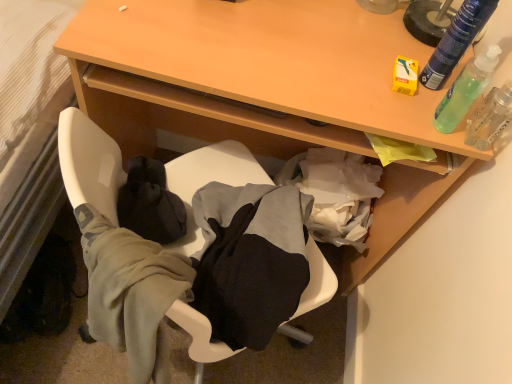
Find the location of a particular element. This screenshot has width=512, height=384. vacant region to the left of clear plastic spray bottle at upper right is located at coordinates (387, 96).